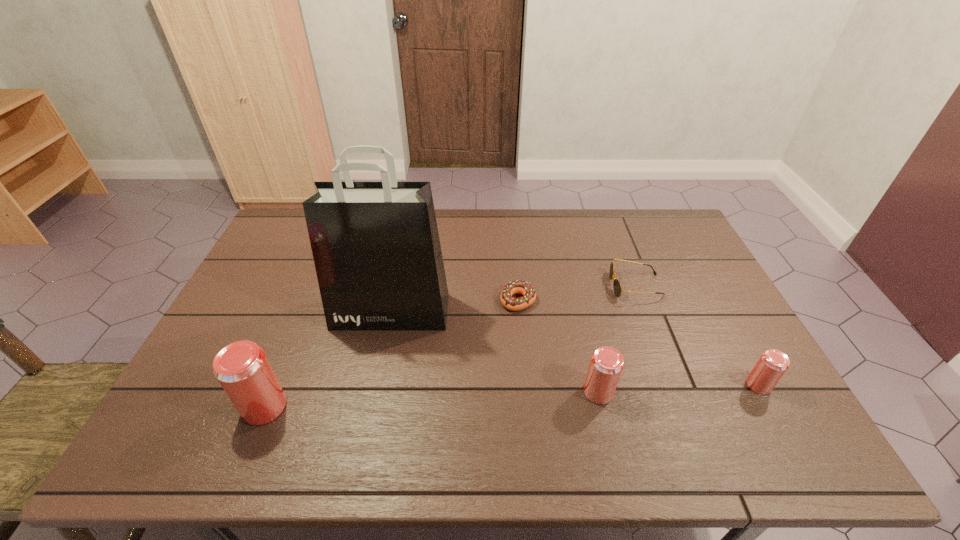
At what (x,y) coordinates should I click in order to perform the action: click on free space between the sunglasses and the rightmost beer can. Please return your answer as a coordinate pair (x, y). The height and width of the screenshot is (540, 960). Looking at the image, I should click on (697, 335).

Where is `free space between the second object from left to right and the fourth object from right to left`? The width and height of the screenshot is (960, 540). free space between the second object from left to right and the fourth object from right to left is located at coordinates (454, 306).

I want to click on free spot between the second tallest object and the tallest object, so click(x=327, y=359).

The height and width of the screenshot is (540, 960). What are the coordinates of `unoccupied area between the fifth object from left to right and the tallest beer can` in the screenshot? It's located at (450, 346).

In order to click on free space between the doughnut and the rightmost beer can in this screenshot , I will do pyautogui.click(x=638, y=343).

Where is `the fifth closest object relative to the fifth shortest object`? the fifth closest object relative to the fifth shortest object is located at coordinates (771, 366).

Select which object appears as the fourth closest to the shortest beer can. Please provide its 2D coordinates. Your answer should be formatted as a tuple, i.e. [(x, y)], where the tuple contains the x and y coordinates of a point satisfying the conditions above.

[(376, 248)]

Identify the location of beer can that stands as the closest to the leftmost object. (606, 365).

At what (x,y) coordinates should I click in order to perform the action: click on beer can that stands as the second closest to the rightmost beer can. Please return your answer as a coordinate pair (x, y). Looking at the image, I should click on (242, 368).

I want to click on free space that satisfies the following two spatial constraints: 1. on the front with handles of the fourth object from left to right; 2. on the left side of the tallest object, so click(374, 392).